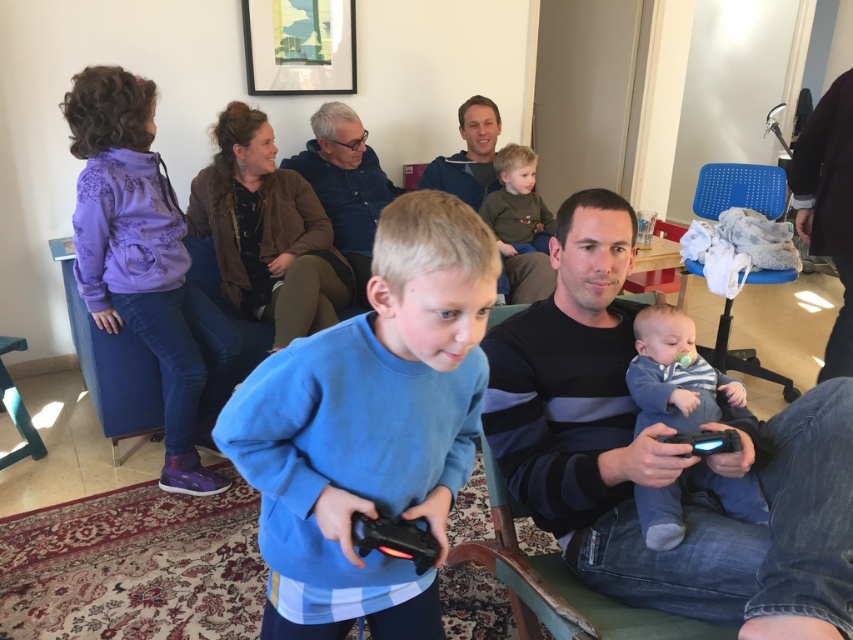
You are standing in the living room and want to take a photo of the two points in the image. Which point, point (445, 536) or point (479, 97), will appear larger in the photo?

Point (445, 536) will appear larger in the photo because it is closer to the camera than point (479, 97).

You are a photographer standing in the living room and want to take a photo of both the dark gray striped shirt at center and the brown leather jacket at upper center. Which object should you focus on first to ensure both are in focus?

You should focus on the dark gray striped shirt at center first because it is closer to the viewer than the brown leather jacket at upper center. By focusing on the closer object, the farther one will also be in focus due to the depth of field.

You are a delivery person who needs to place a small package between the dark blue fabric armchair at center and the matte blue shirt at center. The package requires a space of 2 meters. Can you fit it there?

The dark blue fabric armchair at center is 2.21 meters from matte blue shirt at center, so yes, the package can be placed between them since the distance is sufficient.